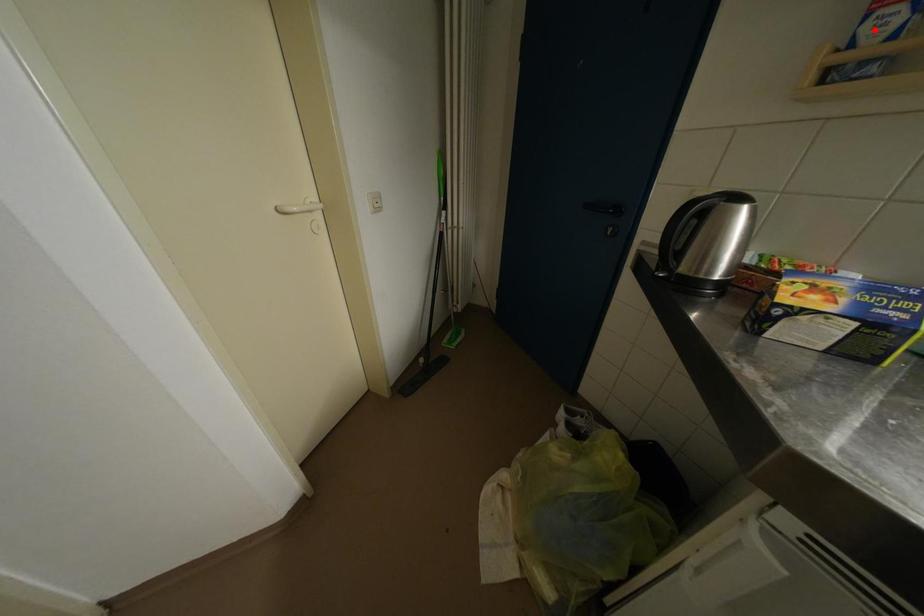
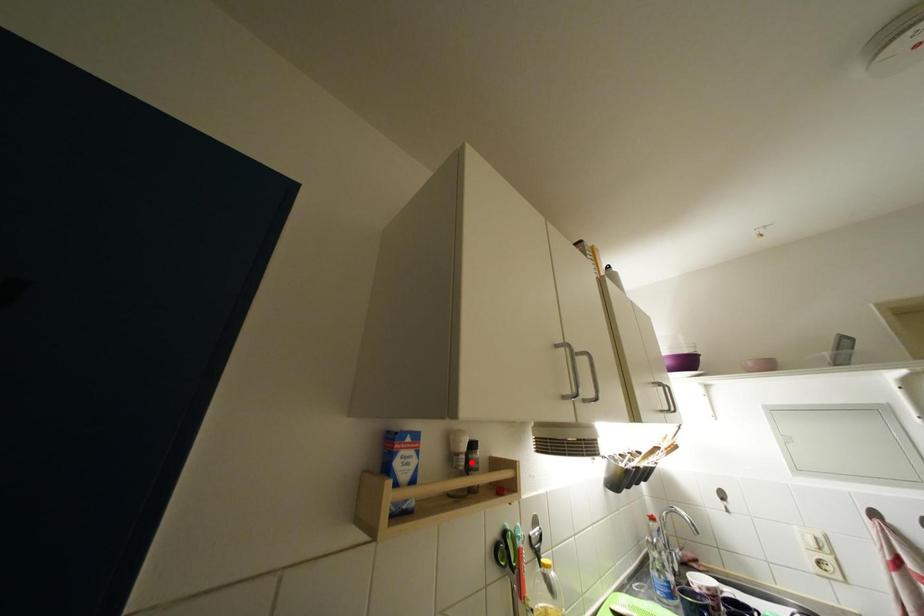
I am providing you with two images of the same scene from different viewpoints. A red point is marked on the first image and another point is marked on the second image. Are the points marked in image1 and image2 representing the same 3D position?

No